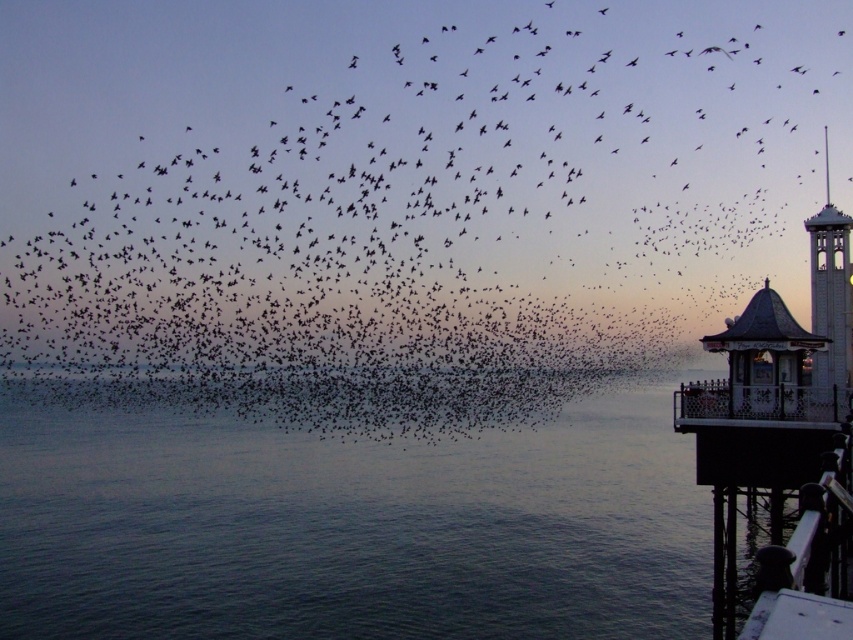
Question: Where is black metal/rail at lower right located in relation to white wood bell tower at right in the image?

Choices:
 (A) below
 (B) above

Answer: (A)

Question: Which object is positioned farthest from the black metal/rail at lower right?

Choices:
 (A) transparent water at lower left
 (B) white wood bell tower at right
 (C) white painted wood dock at lower right
 (D) black matte birds at upper center

Answer: (D)

Question: Is white painted wood dock at lower right positioned in front of white wood bell tower at right?

Choices:
 (A) yes
 (B) no

Answer: (A)

Question: Does white painted wood dock at lower right have a smaller size compared to black metal/rail at lower right?

Choices:
 (A) no
 (B) yes

Answer: (A)

Question: Which point is farther to the camera?

Choices:
 (A) black metal/rail at lower right
 (B) white wood bell tower at right
 (C) white painted wood dock at lower right
 (D) black matte birds at upper center

Answer: (D)

Question: Which object appears farthest from the camera in this image?

Choices:
 (A) black matte birds at upper center
 (B) white painted wood dock at lower right

Answer: (A)